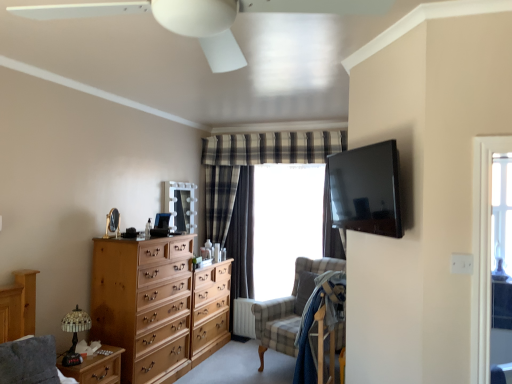
Question: Is checkered fabric swivel chair at center positioned behind white textured radiator at lower center?

Choices:
 (A) yes
 (B) no

Answer: (B)

Question: From a real-world perspective, is checkered fabric swivel chair at center located beneath white textured radiator at lower center?

Choices:
 (A) yes
 (B) no

Answer: (B)

Question: Is checkered fabric swivel chair at center taller than white textured radiator at lower center?

Choices:
 (A) no
 (B) yes

Answer: (B)

Question: Considering the relative positions of checkered fabric swivel chair at center and white textured radiator at lower center in the image provided, is checkered fabric swivel chair at center to the right of white textured radiator at lower center from the viewer's perspective?

Choices:
 (A) yes
 (B) no

Answer: (A)

Question: Is checkered fabric swivel chair at center completely or partially outside of white textured radiator at lower center?

Choices:
 (A) yes
 (B) no

Answer: (A)

Question: From the image's perspective, does checkered fabric swivel chair at center appear lower than white textured radiator at lower center?

Choices:
 (A) no
 (B) yes

Answer: (A)

Question: Is matte black tv at upper right not inside wooden nightstand at lower left?

Choices:
 (A) no
 (B) yes

Answer: (B)

Question: Is matte black tv at upper right oriented towards wooden nightstand at lower left?

Choices:
 (A) no
 (B) yes

Answer: (A)

Question: From the image's perspective, is matte black tv at upper right on top of wooden nightstand at lower left?

Choices:
 (A) yes
 (B) no

Answer: (A)

Question: Are matte black tv at upper right and wooden nightstand at lower left beside each other?

Choices:
 (A) yes
 (B) no

Answer: (B)

Question: Considering the relative sizes of matte black tv at upper right and wooden nightstand at lower left in the image provided, is matte black tv at upper right bigger than wooden nightstand at lower left?

Choices:
 (A) no
 (B) yes

Answer: (A)

Question: Is matte black tv at upper right thinner than wooden nightstand at lower left?

Choices:
 (A) yes
 (B) no

Answer: (A)

Question: Considering the relative sizes of checkered fabric swivel chair at center and white plastic ceiling fan at upper center in the image provided, is checkered fabric swivel chair at center thinner than white plastic ceiling fan at upper center?

Choices:
 (A) no
 (B) yes

Answer: (B)